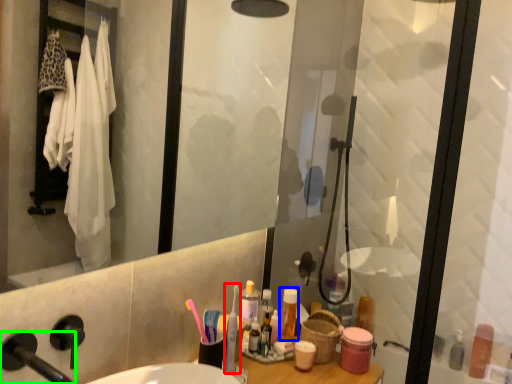
Question: Which object is the farthest from toothbrush (highlighted by a red box)? Choose among these: toiletry (highlighted by a blue box) or faucet (highlighted by a green box).

Choices:
 (A) toiletry
 (B) faucet

Answer: (B)